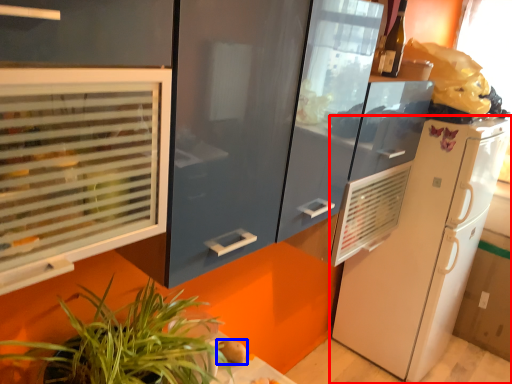
Question: Which object is closer to the camera taking this photo, refrigerator (highlighted by a red box) or food (highlighted by a blue box)?

Choices:
 (A) refrigerator
 (B) food

Answer: (B)